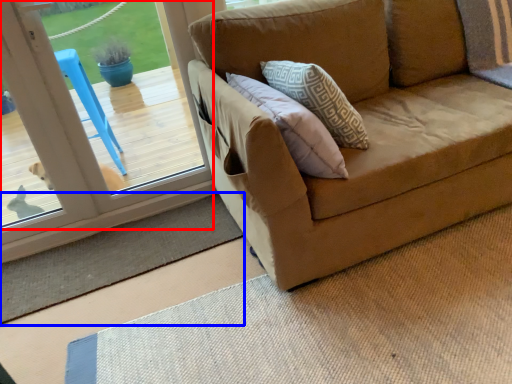
Question: Which object is closer to the camera taking this photo, window (highlighted by a red box) or doormat (highlighted by a blue box)?

Choices:
 (A) window
 (B) doormat

Answer: (A)